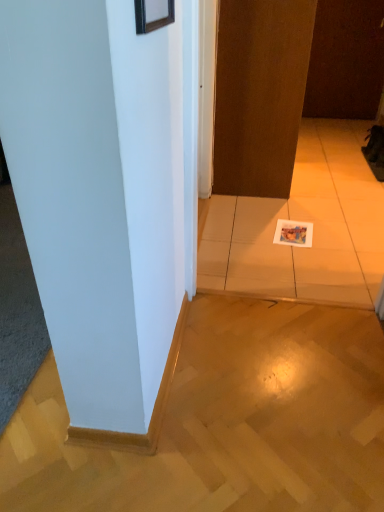
Question: Considering the relative positions of white smooth pillar at center and wooden picture frame at upper center in the image provided, is white smooth pillar at center to the left of wooden picture frame at upper center from the viewer's perspective?

Choices:
 (A) no
 (B) yes

Answer: (B)

Question: Is white smooth pillar at center oriented towards wooden picture frame at upper center?

Choices:
 (A) yes
 (B) no

Answer: (B)

Question: Is white smooth pillar at center wider than wooden picture frame at upper center?

Choices:
 (A) no
 (B) yes

Answer: (B)

Question: Could wooden picture frame at upper center be considered to be inside white smooth pillar at center?

Choices:
 (A) yes
 (B) no

Answer: (B)

Question: From the image's perspective, does white smooth pillar at center appear higher than wooden picture frame at upper center?

Choices:
 (A) no
 (B) yes

Answer: (A)

Question: Are white smooth pillar at center and wooden picture frame at upper center beside each other?

Choices:
 (A) yes
 (B) no

Answer: (B)

Question: Can we say white smooth pillar at center lies outside brown matte door at center, placed as the 2th door when sorted from back to front?

Choices:
 (A) no
 (B) yes

Answer: (B)

Question: Does white smooth pillar at center have a smaller size compared to brown matte door at center, which appears as the 2th door when viewed from the top?

Choices:
 (A) yes
 (B) no

Answer: (B)

Question: Could you tell me if white smooth pillar at center is facing brown matte door at center, placed as the first door when sorted from front to back?

Choices:
 (A) no
 (B) yes

Answer: (A)

Question: Is white smooth pillar at center shorter than brown matte door at center, which is the first door from left to right?

Choices:
 (A) no
 (B) yes

Answer: (B)

Question: From the image's perspective, is white smooth pillar at center on top of brown matte door at center, which appears as the 2th door when viewed from the top?

Choices:
 (A) no
 (B) yes

Answer: (A)

Question: Can you confirm if white smooth pillar at center is bigger than brown matte door at center, placed as the 1th door when sorted from bottom to top?

Choices:
 (A) yes
 (B) no

Answer: (A)

Question: Is white smooth pillar at center surrounding brown matte door at upper right, which ranks as the second door in front-to-back order?

Choices:
 (A) no
 (B) yes

Answer: (A)